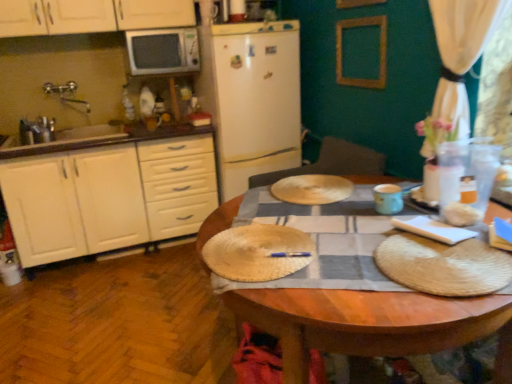
Locate an element on the screen. The image size is (512, 384). free space in front of matte blue cup at center right is located at coordinates (385, 228).